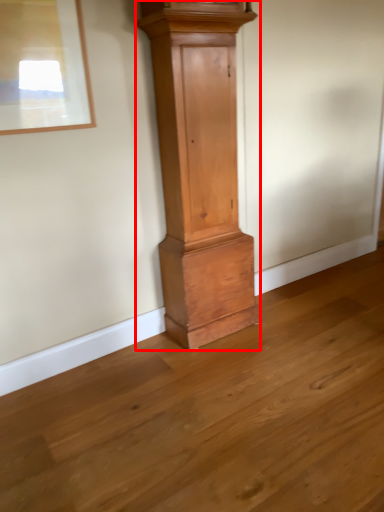
Question: In this image, where is furniture (annotated by the red box) located relative to picture frame?

Choices:
 (A) left
 (B) right

Answer: (B)